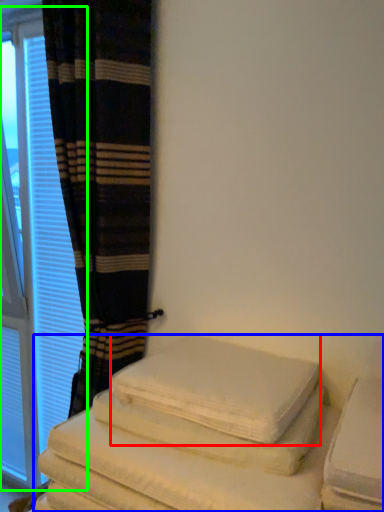
Question: Which object is positioned closest to bath towel (highlighted by a red box)? Select from furniture (highlighted by a blue box) and window (highlighted by a green box).

Choices:
 (A) furniture
 (B) window

Answer: (A)